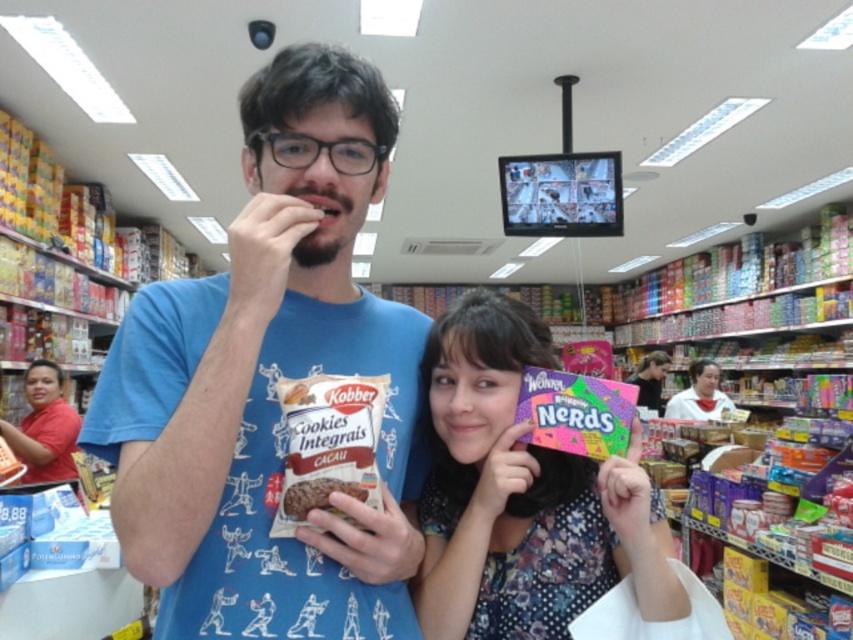
Is point (491, 612) closer to camera compared to point (56, 467)?

Yes, it is in front of point (56, 467).

Who is lower down, multicolored paper candy at center or red shirt at lower left?

Positioned lower is red shirt at lower left.

What do you see at coordinates (521, 496) in the screenshot? I see `multicolored paper candy at center` at bounding box center [521, 496].

At what (x,y) coordinates should I click in order to perform the action: click on multicolored paper candy at center. Please return your answer as a coordinate pair (x, y). The height and width of the screenshot is (640, 853). Looking at the image, I should click on (521, 496).

Is brown matte cookies at center wider than matte pink candy at center?

No.

Can you confirm if brown matte cookies at center is bigger than matte pink candy at center?

Actually, brown matte cookies at center might be smaller than matte pink candy at center.

Does point (361, 486) come closer to viewer compared to point (659, 396)?

Yes, it is.

Identify the location of brown matte cookies at center. The image size is (853, 640). (317, 496).

Does multicolored paper candy at center have a greater width compared to brown matte cookies at center?

Yes, multicolored paper candy at center is wider than brown matte cookies at center.

Which is above, multicolored paper candy at center or brown matte cookies at center?

brown matte cookies at center

Who is more forward, (462,490) or (314,496)?

Point (314,496)

I want to click on multicolored paper candy at center, so click(x=521, y=496).